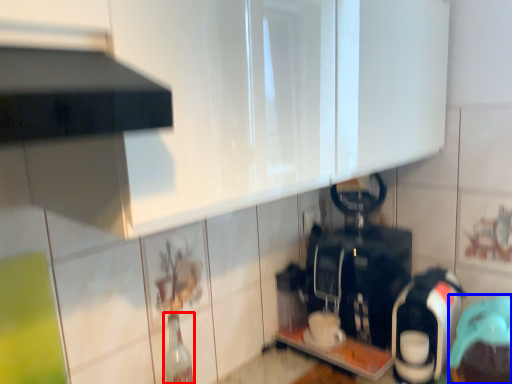
Question: Which point is further to the camera, bottle (highlighted by a red box) or appliance (highlighted by a blue box)?

Choices:
 (A) bottle
 (B) appliance

Answer: (A)